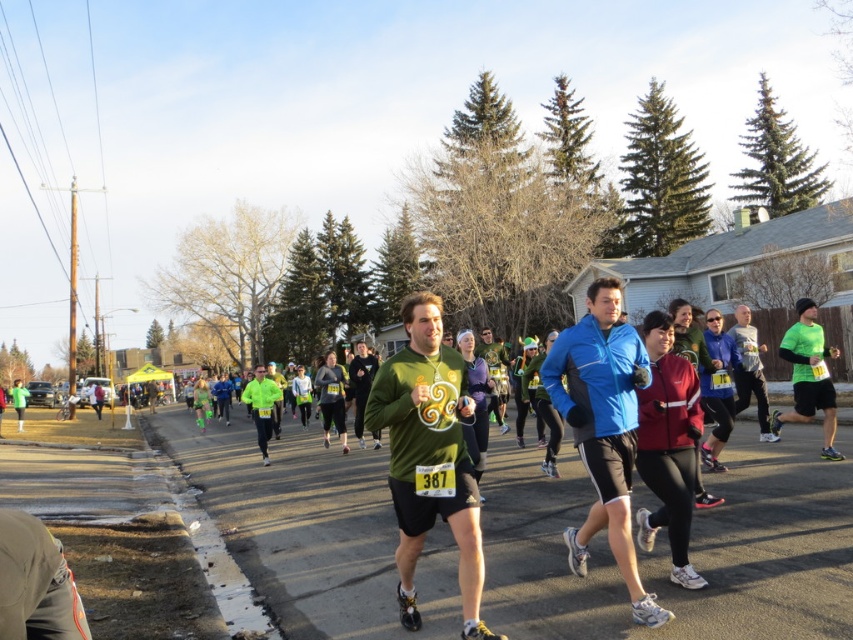
You are a photographer at the marathon event and want to capture both the green fleece jacket at center and the green matte sweater at center in a single frame. Which object should you focus on first if you want to ensure both are in the frame?

You should focus on the green fleece jacket at center first because it is smaller in size compared to the green matte sweater at center, allowing you to frame both effectively.

You are a photographer at the marathon event. You need to capture a photo where the blue fabric jacket at center and the green matte sweater at center are clearly visible. Considering their sizes, which one might you need to zoom in more on to ensure clarity?

The blue fabric jacket at center is thinner than the green matte sweater at center, so you might need to zoom in more on the blue fabric jacket at center to ensure its details are clear.